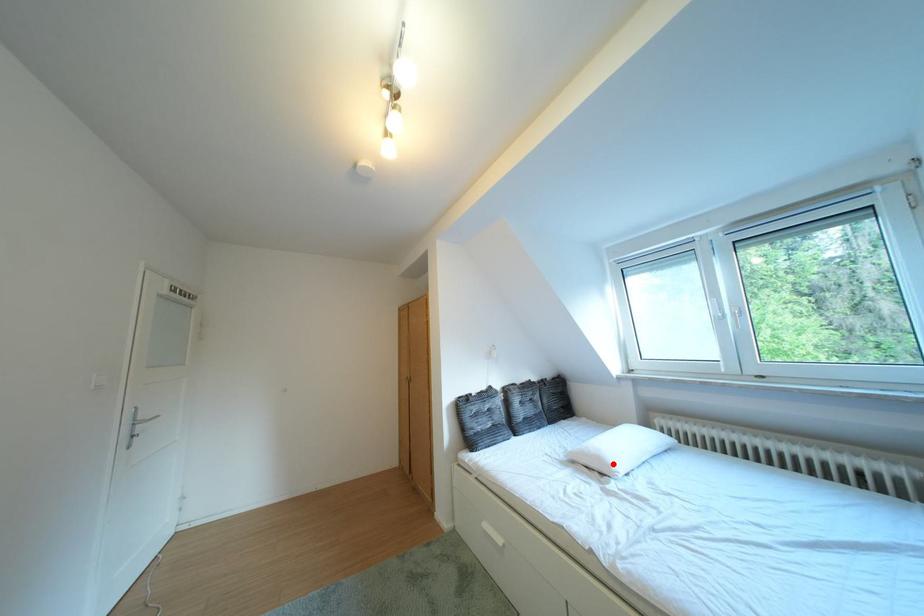
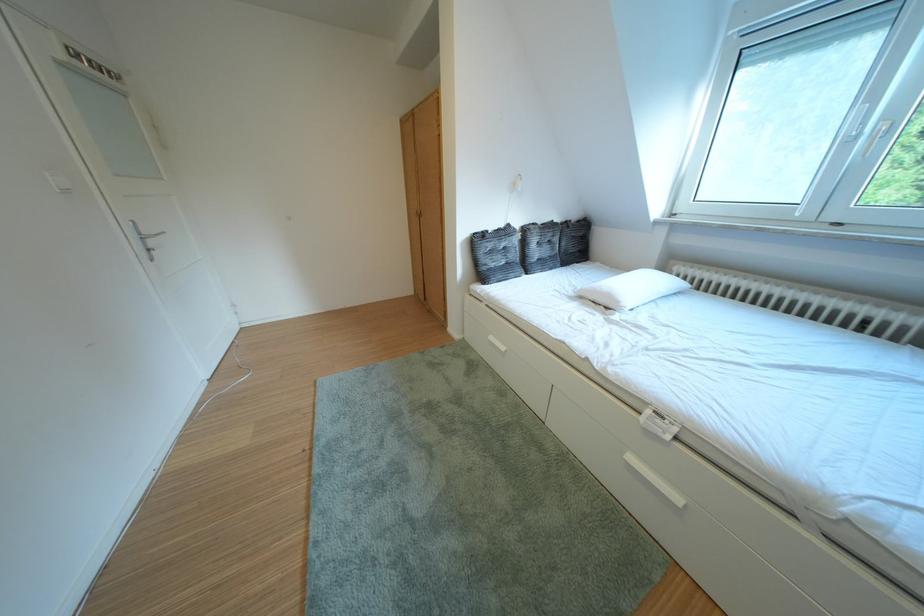
Question: I am providing you with two images of the same scene from different viewpoints. A red point is shown in image1. For the corresponding object point in image2, is it positioned nearer or farther from the camera?

Choices:
 (A) Nearer
 (B) Farther

Answer: (A)